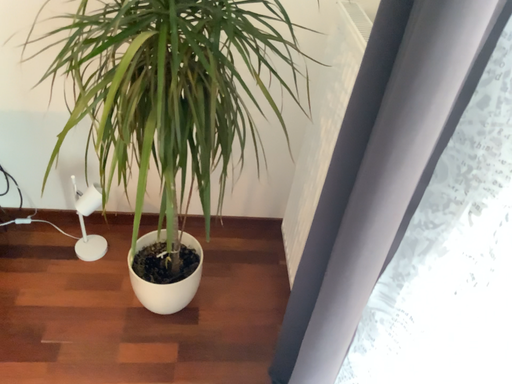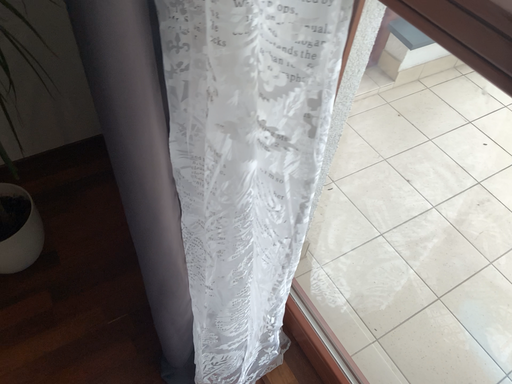
Question: Which way did the camera rotate in the video?

Choices:
 (A) rotated left
 (B) rotated right

Answer: (B)